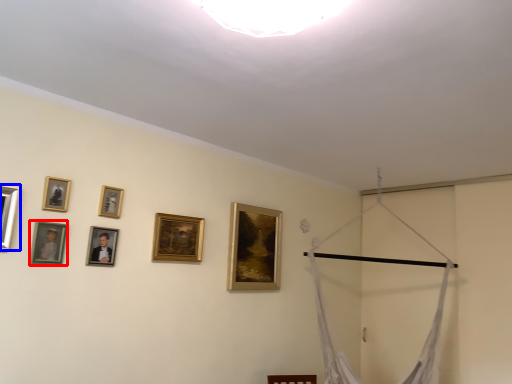
Question: Which object appears closest to the camera in this image, picture frame (highlighted by a red box) or picture frame (highlighted by a blue box)?

Choices:
 (A) picture frame
 (B) picture frame

Answer: (B)